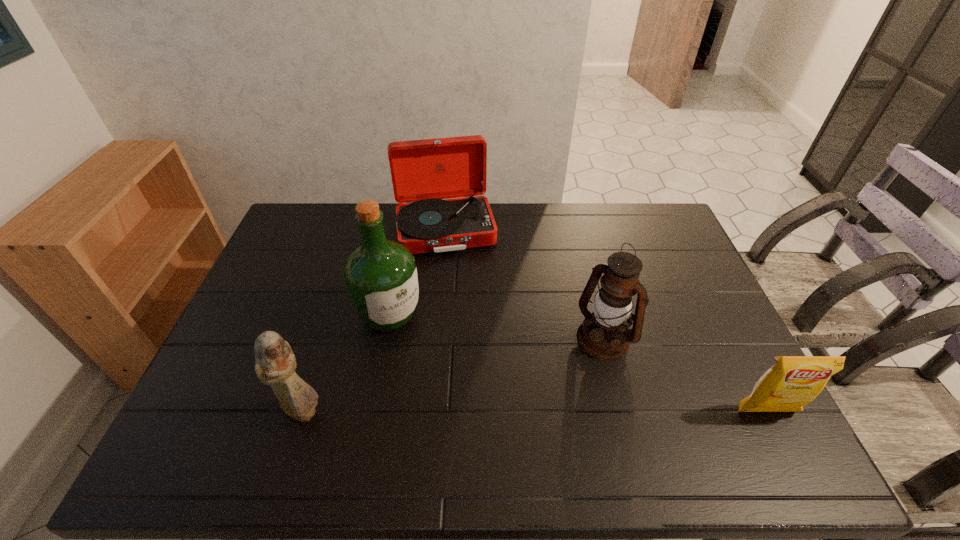
You are a GUI agent. You are given a task and a screenshot of the screen. Output one action in this format:
    pyautogui.click(x=<x>, y=<y>)
    Task: Click on the free space located on the front-facing side of the liquor
    This screenshot has height=540, width=960.
    Given the screenshot: What is the action you would take?
    pyautogui.click(x=425, y=349)

Identify the location of free space located 0.250m on the front-facing side of the liquor. This screenshot has height=540, width=960. (469, 392).

This screenshot has height=540, width=960. I want to click on free space located 0.070m on the front-facing side of the liquor, so coord(425,349).

Where is `free space located on the front-facing side of the phonograph_record`? free space located on the front-facing side of the phonograph_record is located at coordinates (462, 306).

Locate an element on the screen. The width and height of the screenshot is (960, 540). free spot located 0.200m on the front-facing side of the phonograph_record is located at coordinates (461, 301).

Image resolution: width=960 pixels, height=540 pixels. Find the location of `vacant area situated on the front-facing side of the phonograph_record`. vacant area situated on the front-facing side of the phonograph_record is located at coordinates (468, 337).

The height and width of the screenshot is (540, 960). In order to click on object that is at the far edge in this screenshot , I will do `click(424, 172)`.

At what (x,y) coordinates should I click in order to perform the action: click on figurine located in the near edge section of the desktop. Please return your answer as a coordinate pair (x, y). The width and height of the screenshot is (960, 540). Looking at the image, I should click on (275, 365).

This screenshot has height=540, width=960. Find the location of `crisp (potato chip) positioned at the near edge`. crisp (potato chip) positioned at the near edge is located at coordinates (793, 381).

Find the location of a particular element. This screenshot has width=960, height=540. object present at the right edge is located at coordinates (793, 381).